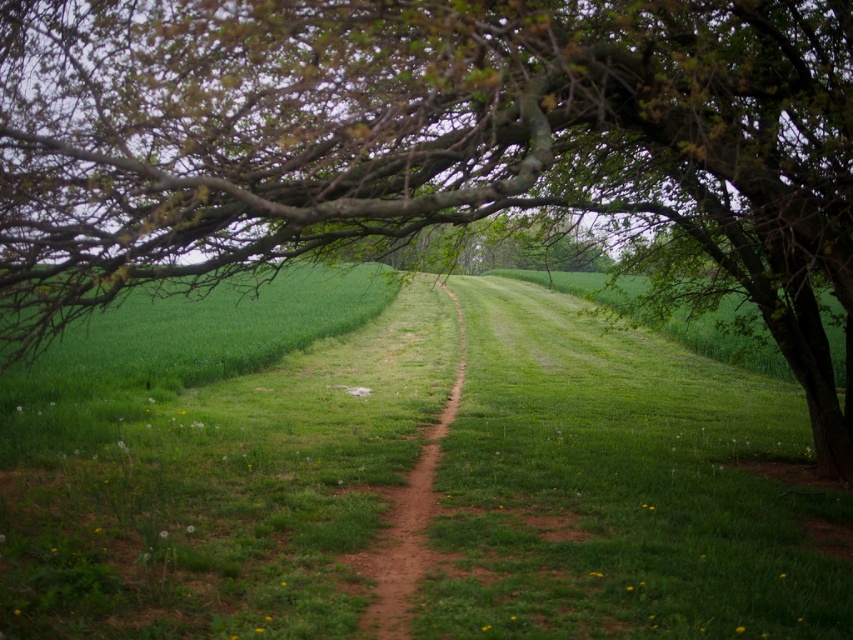
Question: Which point is closer to the camera?

Choices:
 (A) (459, 360)
 (B) (212, 563)

Answer: (B)

Question: Which of the following is the closest to the observer?

Choices:
 (A) dirt path at center
 (B) green grassy at center

Answer: (B)

Question: Can you confirm if green grassy at center is bigger than dirt path at center?

Choices:
 (A) yes
 (B) no

Answer: (A)

Question: Does green grassy at center have a larger size compared to dirt path at center?

Choices:
 (A) no
 (B) yes

Answer: (B)

Question: Which of the following is the closest to the observer?

Choices:
 (A) (10, 614)
 (B) (372, 556)

Answer: (A)

Question: Can you confirm if green grassy at center is positioned below dirt path at center?

Choices:
 (A) yes
 (B) no

Answer: (B)